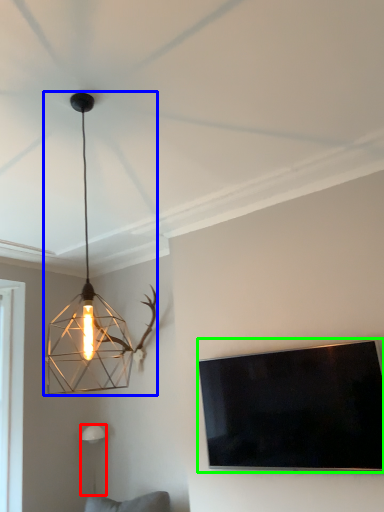
Question: Which is nearer to the lamp (highlighted by a red box)? lamp (highlighted by a blue box) or television (highlighted by a green box).

Choices:
 (A) lamp
 (B) television

Answer: (A)